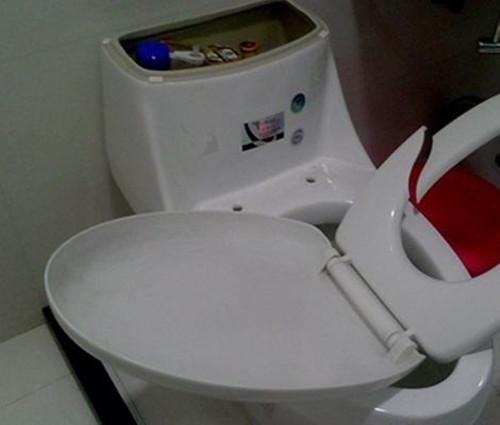
You are a GUI agent. You are given a task and a screenshot of the screen. Output one action in this format:
    pyautogui.click(x=<x>, y=<y>)
    Task: Click on the blue float in toilet
    Image resolution: width=500 pixels, height=425 pixels.
    Given the screenshot: What is the action you would take?
    pyautogui.click(x=153, y=61)